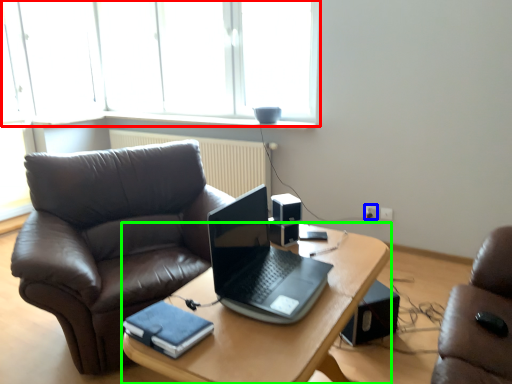
Question: Based on their relative distances, which object is nearer to window (highlighted by a red box)? Choose from power outlet (highlighted by a blue box) and desk (highlighted by a green box).

Choices:
 (A) power outlet
 (B) desk

Answer: (A)